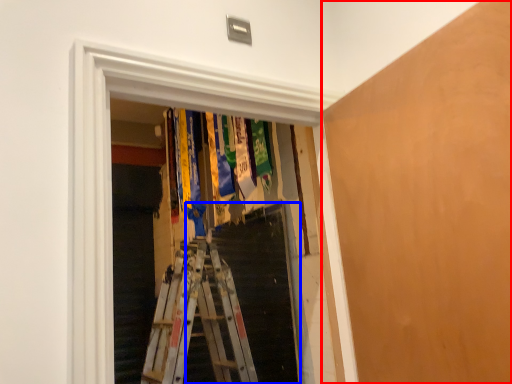
Question: Which point is closer to the camera, plywood (highlighted by a red box) or stairs (highlighted by a blue box)?

Choices:
 (A) plywood
 (B) stairs

Answer: (A)